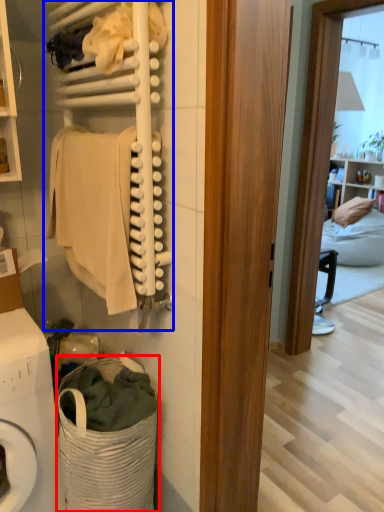
Question: Which object is closer to the camera taking this photo, laundry basket (highlighted by a red box) or closet (highlighted by a blue box)?

Choices:
 (A) laundry basket
 (B) closet

Answer: (B)